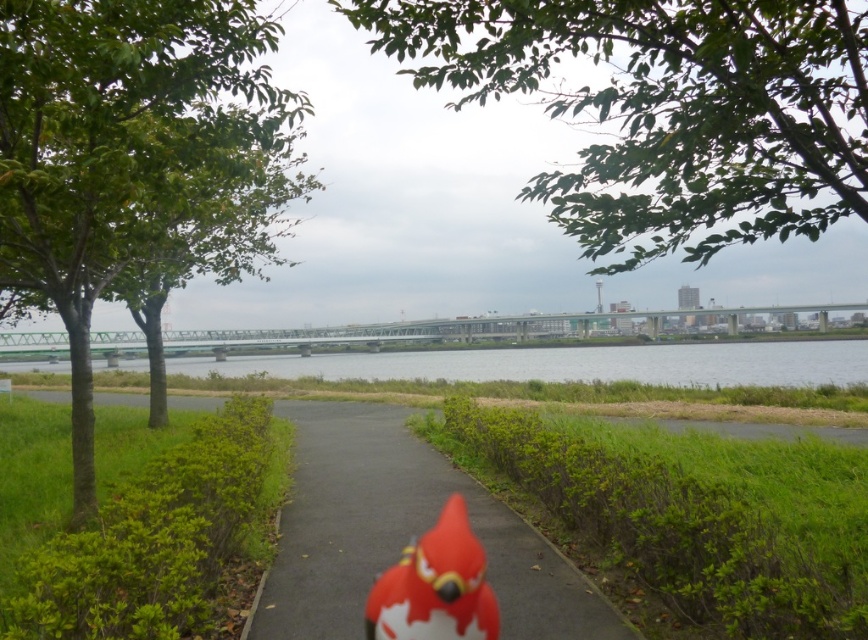
The image size is (868, 640). I want to click on green leafy tree at upper center, so click(665, 109).

Is green leafy tree at left shorter than smooth asphalt path at center?

No, green leafy tree at left is not shorter than smooth asphalt path at center.

Who is higher up, green leafy tree at left or smooth asphalt path at center?

green leafy tree at left is higher up.

This screenshot has height=640, width=868. I want to click on green leafy tree at left, so click(117, 147).

Image resolution: width=868 pixels, height=640 pixels. I want to click on green leafy tree at left, so click(x=117, y=147).

The image size is (868, 640). Identify the location of green leafy tree at upper center. (665, 109).

Is green leafy tree at upper center above green leafy tree at left?

Yes.

What do you see at coordinates (665, 109) in the screenshot?
I see `green leafy tree at upper center` at bounding box center [665, 109].

The height and width of the screenshot is (640, 868). I want to click on green leafy tree at upper center, so click(x=665, y=109).